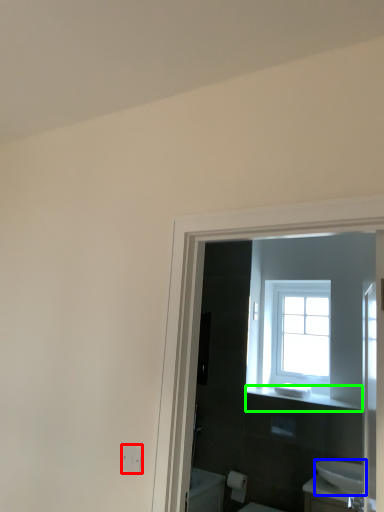
Question: Which object is positioned farthest from electric outlet (highlighted by a red box)? Select from sink (highlighted by a blue box) and balustrade (highlighted by a green box).

Choices:
 (A) sink
 (B) balustrade

Answer: (B)